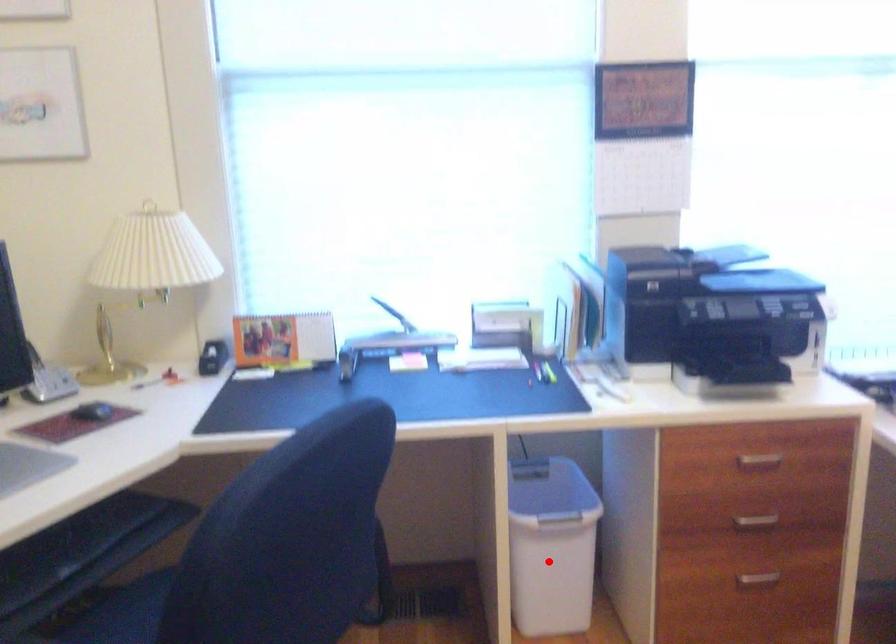
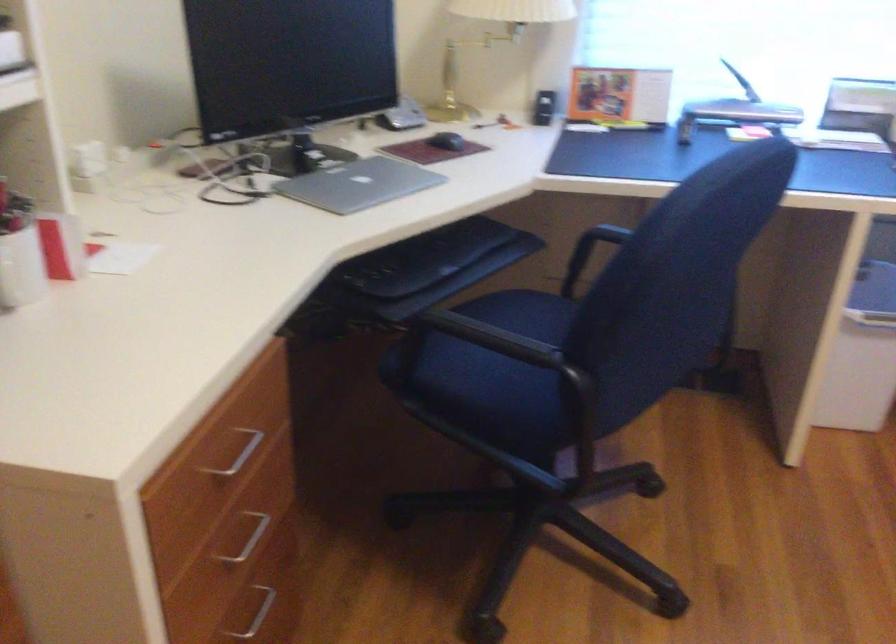
Locate, in the second image, the point that corresponds to the highlighted location in the first image.

(862, 355)